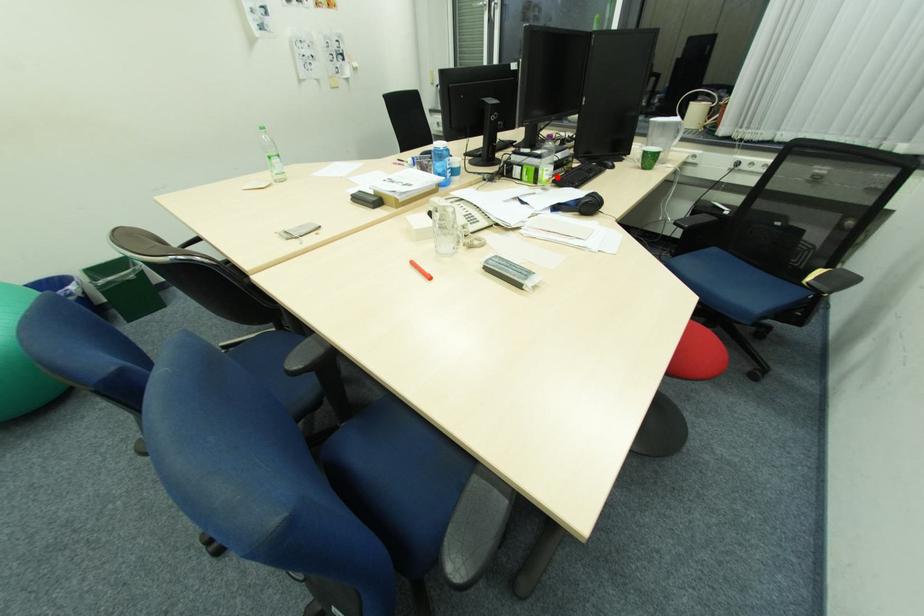
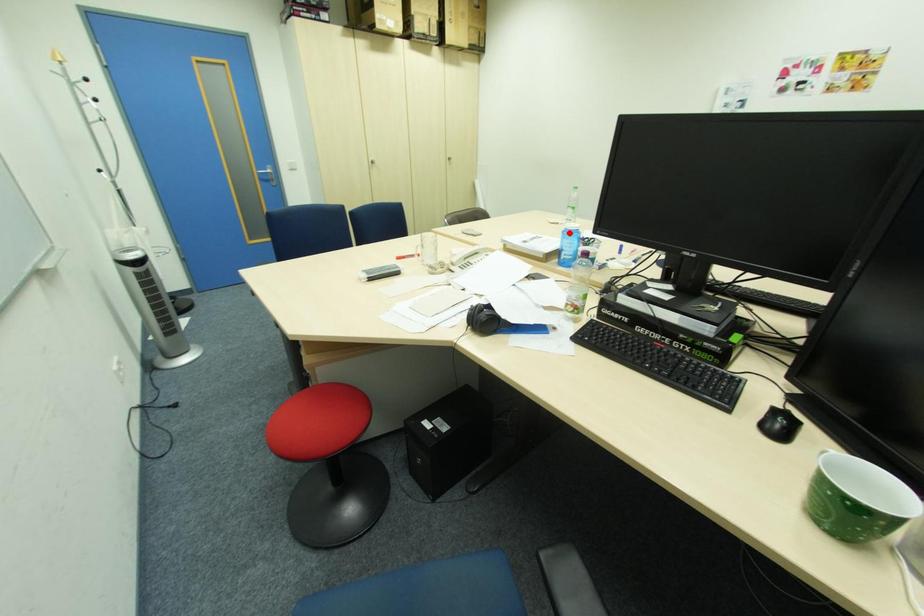
I am providing you with two images of the same scene from different viewpoints. A red point is marked on the first image and another point is marked on the second image. Does the point marked in image1 correspond to the same location as the one in image2?

No